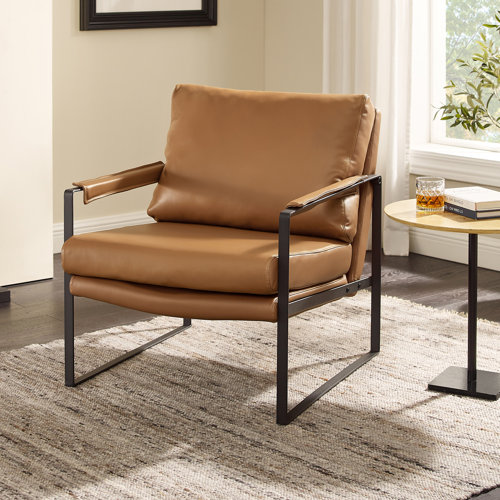
Locate an element on the screen. The height and width of the screenshot is (500, 500). hardwood floor is located at coordinates (40, 308), (92, 317), (421, 276), (482, 297).